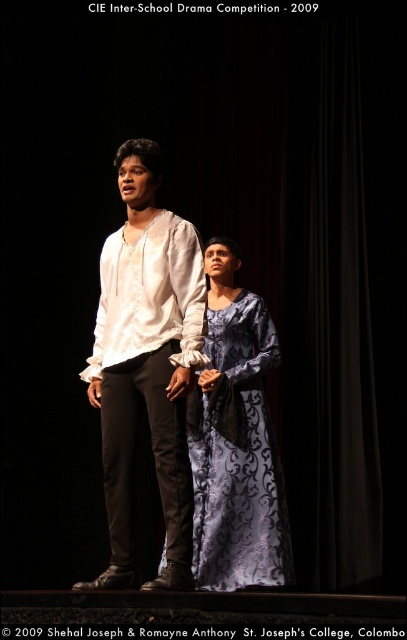
You are sitting in the audience watching the drama performance. You notice two costumes on stage at center. Which one is closer to you, the matte white shirt at center or the silvery blue dress at center?

The matte white shirt at center is closer to the viewer than the silvery blue dress at center.

You are an audience member sitting in the front row of the CIE Inter School Drama Competition in 2009. You notice two points on the stage marked as point 1 at coordinates (124, 518) and point 2 at coordinates (218, 252). Which point is closer to you?

Point 1 at coordinates (124, 518) is closer to you than point 2 at coordinates (218, 252).

You are sitting in the audience at the CIE Inter School Drama Competition 2009. You want to know how far the point marked at coordinates point (157, 252) is from you. Can you determine the distance?

The point marked at coordinates point (157, 252) is 13.11 feet away from the viewer.